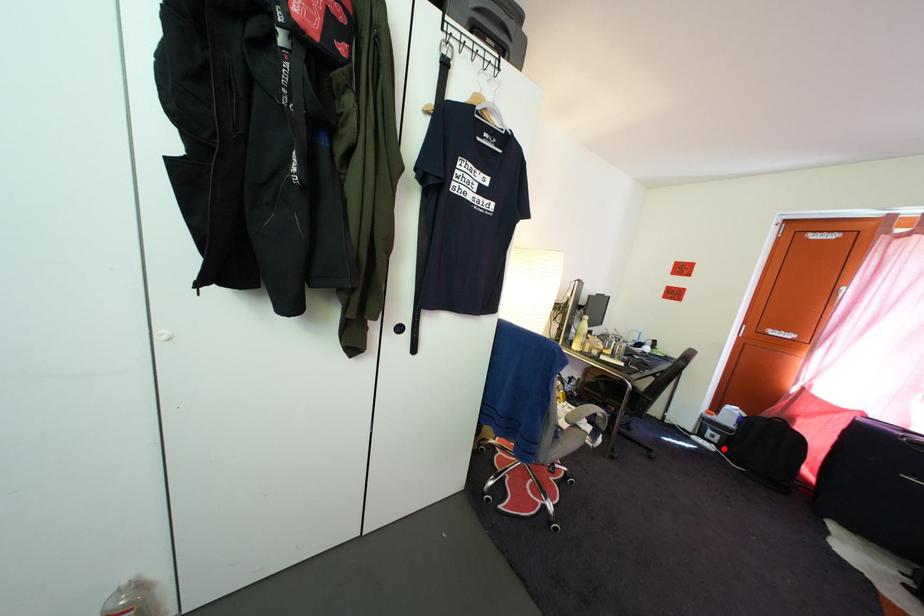
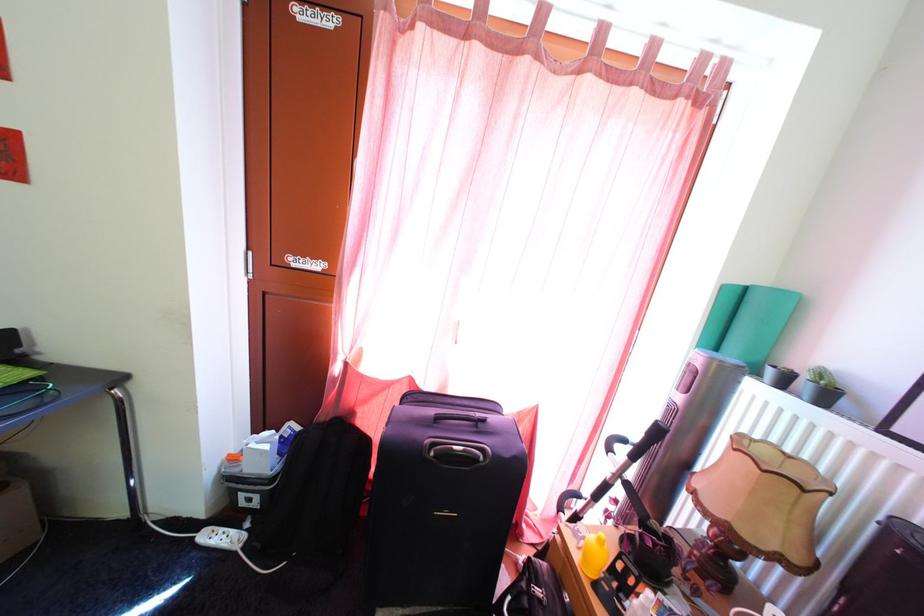
In the second image, find the point that corresponds to the highlighted location in the first image.

(264, 512)